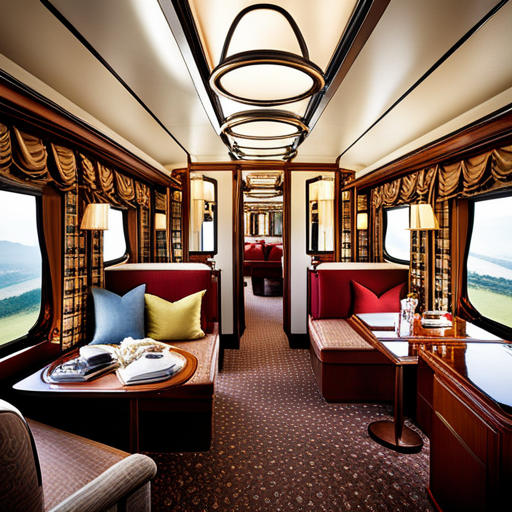
Where is `carpet`? Image resolution: width=512 pixels, height=512 pixels. carpet is located at coordinates (297, 407).